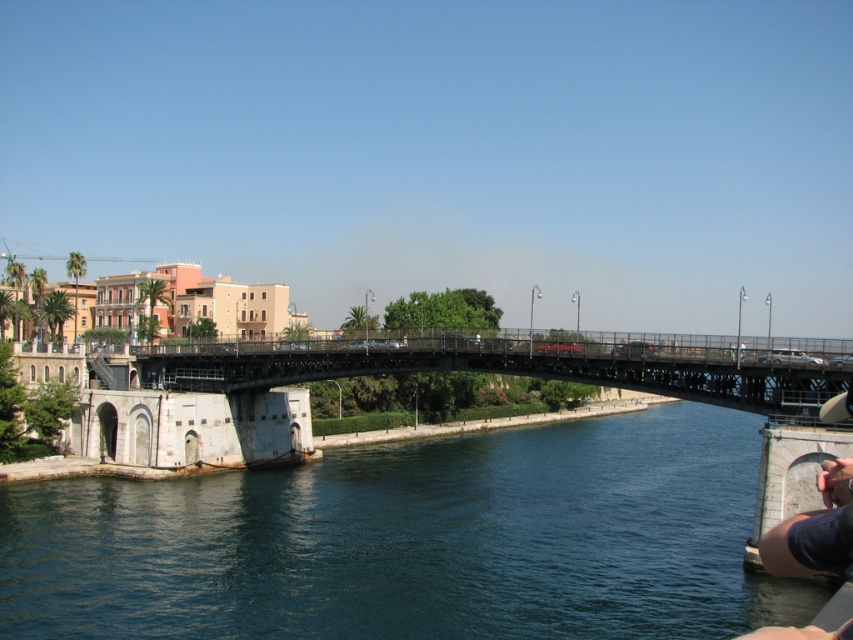
You are standing on the left side of the metallic bridge at center and want to cross to the right side. Which direction should you go relative to the deep blue water at center to reach the other side?

To reach the other side of the metallic bridge at center, you should go to the right of the deep blue water at center since the deep blue water at center is to the right of the metallic bridge at center.

You are a photographer planning to capture the entire scene of the deep blue water at center and the metallic bridge at center in one shot. Based on their sizes, which object should you focus on to ensure both are visible without cropping?

Since the deep blue water at center is larger than the metallic bridge at center, you should focus on the deep blue water at center to ensure both are visible in the frame.